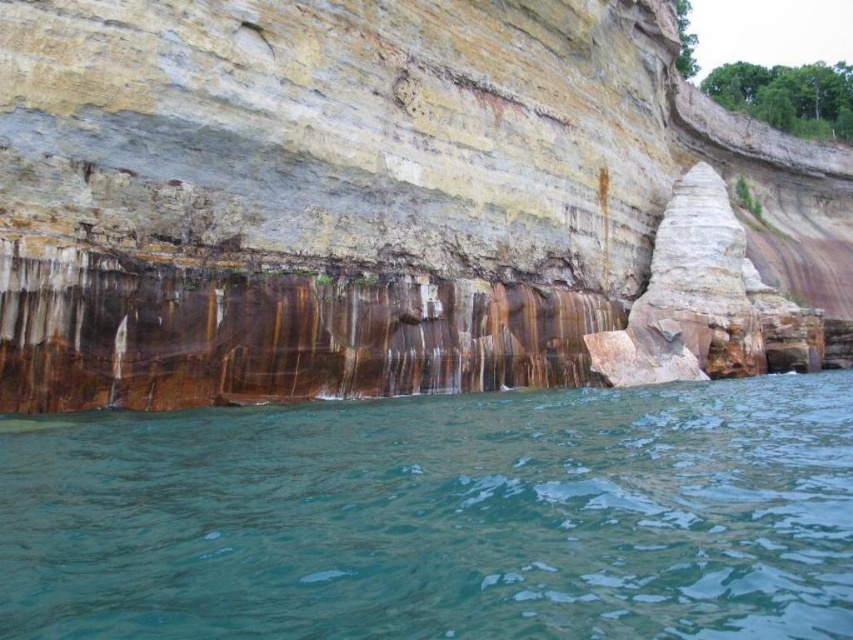
Question: Among these objects, which one is farthest from the camera?

Choices:
 (A) green translucent water at lower center
 (B) rusty metallic rock at center

Answer: (B)

Question: In this image, where is rusty metallic rock at center located relative to green translucent water at lower center?

Choices:
 (A) below
 (B) above

Answer: (B)

Question: Can you confirm if rusty metallic rock at center is bigger than green translucent water at lower center?

Choices:
 (A) yes
 (B) no

Answer: (A)

Question: Does rusty metallic rock at center appear under green translucent water at lower center?

Choices:
 (A) no
 (B) yes

Answer: (A)

Question: Which point is closer to the camera taking this photo?

Choices:
 (A) (107, 608)
 (B) (158, 221)

Answer: (A)